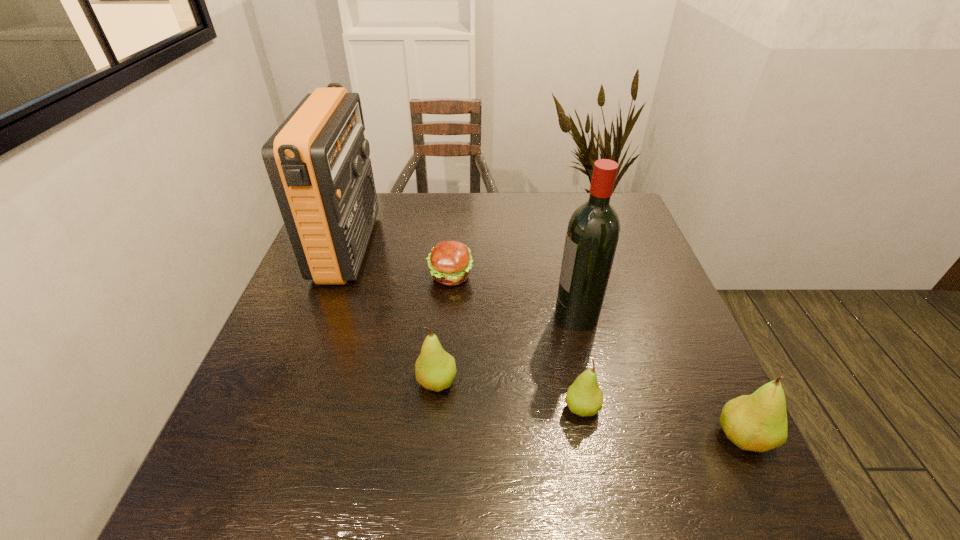
Please point a vacant point for placing a pear on the left. Please provide its 2D coordinates. Your answer should be formatted as a tuple, i.e. [(x, y)], where the tuple contains the x and y coordinates of a point satisfying the conditions above.

[(306, 359)]